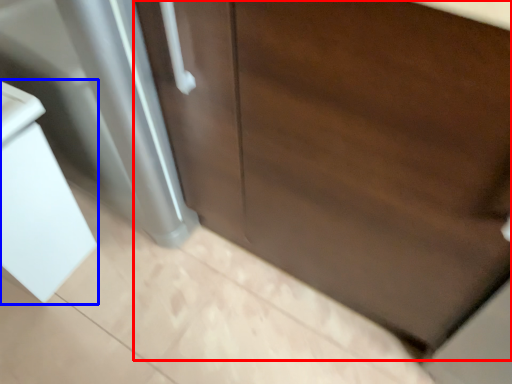
Question: Which point is closer to the camera, door (highlighted by a red box) or sink (highlighted by a blue box)?

Choices:
 (A) door
 (B) sink

Answer: (A)